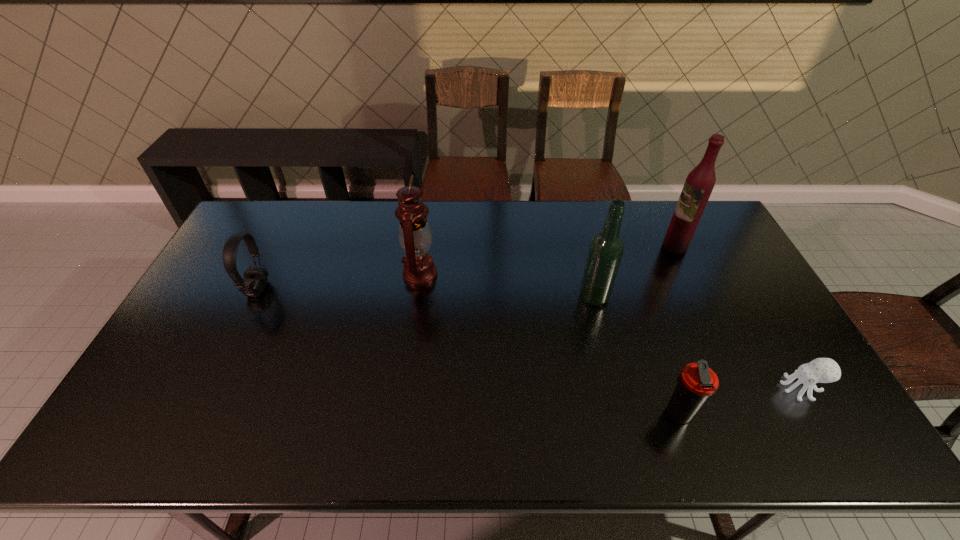
Identify the location of vacant position located 0.140m on the label of the second object from right to left. (622, 246).

Where is `vacant space situated 0.200m on the label of the second object from right to left`? vacant space situated 0.200m on the label of the second object from right to left is located at coordinates (605, 246).

Find the location of a particular element. Image resolution: width=960 pixels, height=540 pixels. vacant space located 0.210m on the right of the oil lamp is located at coordinates (503, 274).

This screenshot has width=960, height=540. Find the location of `free space located 0.190m on the front of the left liquor`. free space located 0.190m on the front of the left liquor is located at coordinates (611, 361).

The image size is (960, 540). What are the coordinates of `vacant space located 0.280m on the front-facing side of the leftmost object` in the screenshot? It's located at (358, 289).

At what (x,y) coordinates should I click in order to perform the action: click on vacant space located 0.080m on the right of the third object from right to left. Please return your answer as a coordinate pair (x, y). The height and width of the screenshot is (540, 960). Looking at the image, I should click on (728, 414).

This screenshot has height=540, width=960. I want to click on free location located on the front-facing side of the octopus, so click(660, 388).

I want to click on vacant space located on the front-facing side of the octopus, so point(648,388).

Identify the location of free spot located 0.270m on the front-facing side of the octopus. The height and width of the screenshot is (540, 960). (675, 388).

Find the location of a particular element. Image resolution: width=960 pixels, height=540 pixels. object that is at the far edge is located at coordinates (700, 182).